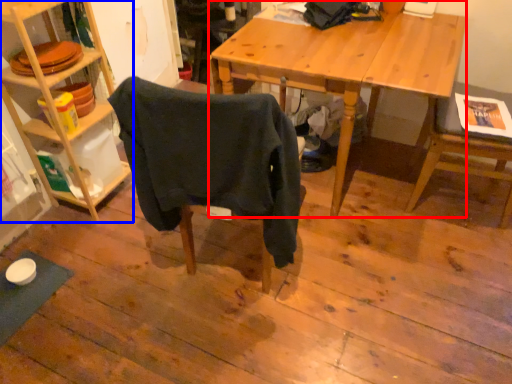
Question: Which of the following is the closest to the observer, desk (highlighted by a red box) or shelf (highlighted by a blue box)?

Choices:
 (A) desk
 (B) shelf

Answer: (B)